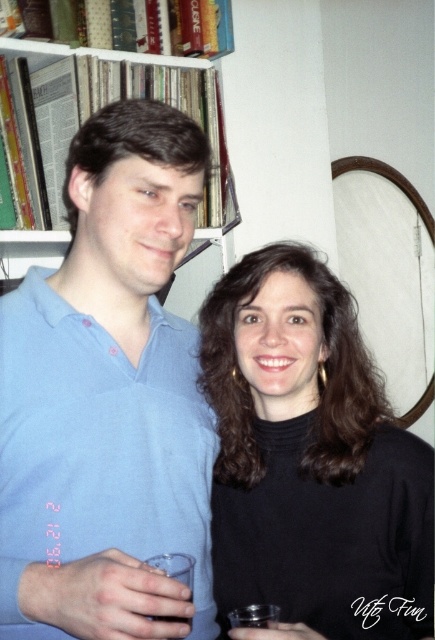
Is light blue cotton shirt at center wider than clear plastic cup at lower left?

Yes.

Is light blue cotton shirt at center below clear plastic cup at lower left?

Incorrect, light blue cotton shirt at center is not positioned below clear plastic cup at lower left.

In the scene shown: Who is more distant from viewer, (13, 461) or (144, 561)?

Point (13, 461)

At what (x,y) coordinates should I click in order to perform the action: click on light blue cotton shirt at center. Please return your answer as a coordinate pair (x, y). Image resolution: width=435 pixels, height=640 pixels. Looking at the image, I should click on (107, 397).

Can you confirm if black matte turtleneck at center is positioned below transparent plastic cup at lower center?

Incorrect, black matte turtleneck at center is not positioned below transparent plastic cup at lower center.

Who is more forward, (357, 401) or (257, 609)?

Point (257, 609) is in front.

Between point (301, 566) and point (267, 627), which one is positioned in front?

Point (267, 627) is more forward.

Where is `black matte turtleneck at center`? The height and width of the screenshot is (640, 435). black matte turtleneck at center is located at coordinates (311, 458).

Is clear plastic cup at lower left bigger than transparent plastic cup at lower center?

Indeed, clear plastic cup at lower left has a larger size compared to transparent plastic cup at lower center.

Which is in front, point (193, 584) or point (248, 620)?

Point (248, 620) is more forward.

Is point (174, 561) in front of point (271, 604)?

Yes, point (174, 561) is in front of point (271, 604).

Identify the location of clear plastic cup at lower left. (176, 566).